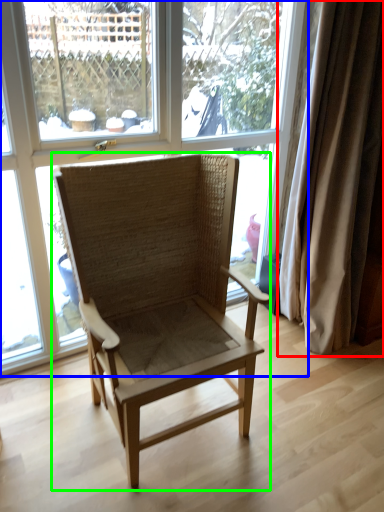
Question: Which object is positioned closest to curtain (highlighted by a red box)? Select from window (highlighted by a blue box) and chair (highlighted by a green box).

Choices:
 (A) window
 (B) chair

Answer: (B)